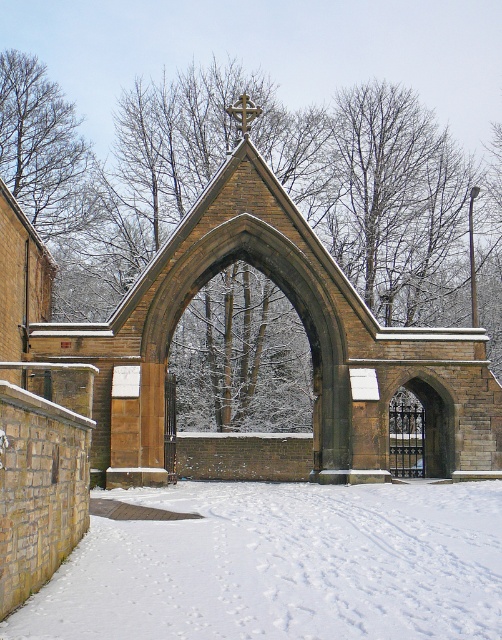
Question: Which object is closer to the camera taking this photo?

Choices:
 (A) white powdery snow at lower center
 (B) brown stone church at center

Answer: (A)

Question: Is white powdery snow at lower center below brown stone church at center?

Choices:
 (A) no
 (B) yes

Answer: (B)

Question: Is white powdery snow at lower center thinner than brown stone church at center?

Choices:
 (A) no
 (B) yes

Answer: (B)

Question: Among these objects, which one is farthest from the camera?

Choices:
 (A) white powdery snow at lower center
 (B) brown stone church at center

Answer: (B)

Question: Is white powdery snow at lower center further to camera compared to brown stone church at center?

Choices:
 (A) no
 (B) yes

Answer: (A)